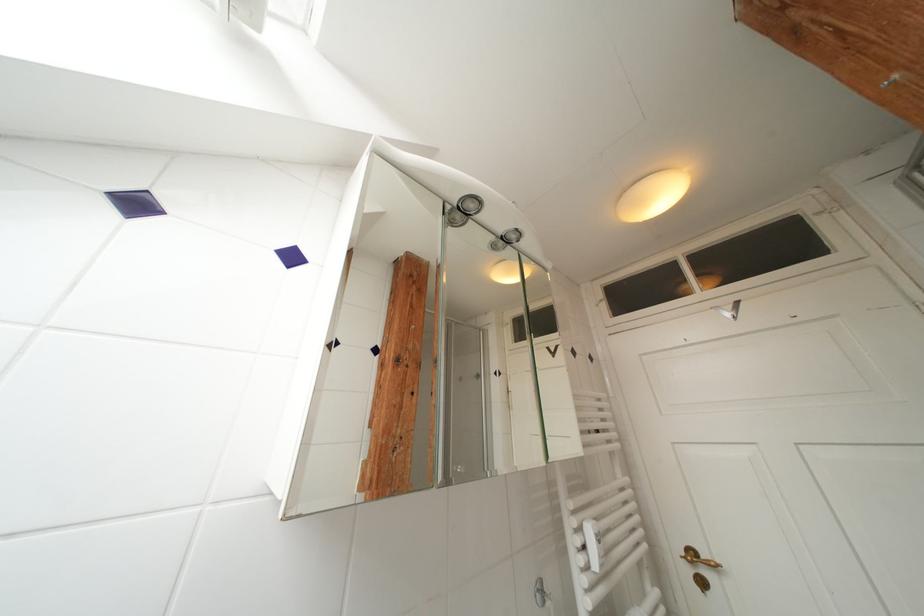
Where is `silver door hook`? silver door hook is located at coordinates (541, 594).